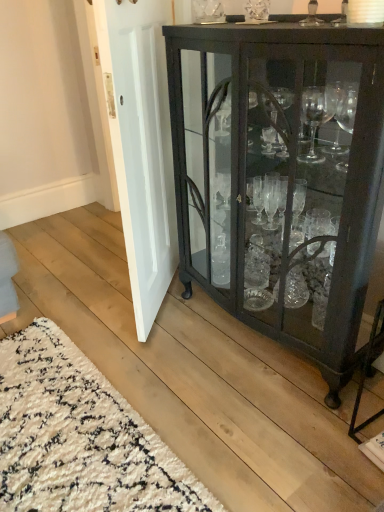
In order to click on blank area beneath matte black cabinet at right (from a real-world perspective) in this screenshot , I will do `click(253, 342)`.